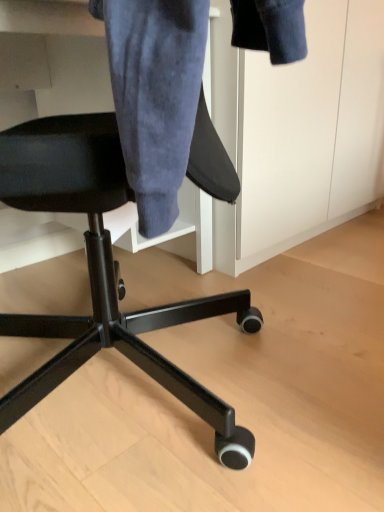
Question: Does black fabric chair at center come behind denim jacket at upper center?

Choices:
 (A) no
 (B) yes

Answer: (A)

Question: Is black fabric chair at center positioned with its back to denim jacket at upper center?

Choices:
 (A) yes
 (B) no

Answer: (B)

Question: From the image's perspective, is black fabric chair at center under denim jacket at upper center?

Choices:
 (A) no
 (B) yes

Answer: (B)

Question: From a real-world perspective, is black fabric chair at center on denim jacket at upper center?

Choices:
 (A) no
 (B) yes

Answer: (A)

Question: From the image's perspective, would you say black fabric chair at center is positioned over denim jacket at upper center?

Choices:
 (A) yes
 (B) no

Answer: (B)

Question: Is black fabric chair at center completely or partially outside of denim jacket at upper center?

Choices:
 (A) no
 (B) yes

Answer: (B)

Question: Is denim jacket at upper center behind black fabric chair at center?

Choices:
 (A) yes
 (B) no

Answer: (A)

Question: Considering the relative positions of denim jacket at upper center and black fabric chair at center in the image provided, is denim jacket at upper center to the right of black fabric chair at center from the viewer's perspective?

Choices:
 (A) no
 (B) yes

Answer: (B)

Question: Is denim jacket at upper center placed right next to black fabric chair at center?

Choices:
 (A) yes
 (B) no

Answer: (B)

Question: Is denim jacket at upper center positioned beyond the bounds of black fabric chair at center?

Choices:
 (A) yes
 (B) no

Answer: (A)

Question: Can you confirm if denim jacket at upper center is shorter than black fabric chair at center?

Choices:
 (A) yes
 (B) no

Answer: (B)

Question: Could black fabric chair at center be considered to be inside denim jacket at upper center?

Choices:
 (A) no
 (B) yes

Answer: (A)

Question: From the image's perspective, is denim jacket at upper center above or below black fabric chair at center?

Choices:
 (A) above
 (B) below

Answer: (A)